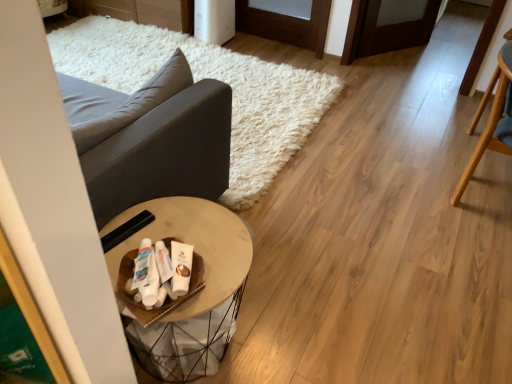
The image size is (512, 384). I want to click on white glossy tube at center, which appears as the 2th toiletry when viewed from the right, so click(x=150, y=284).

Locate an element on the screen. Image resolution: width=512 pixels, height=384 pixels. white matte toothpaste tube at center, which is counted as the 1th toiletry, starting from the left is located at coordinates (142, 264).

The image size is (512, 384). Describe the element at coordinates (190, 285) in the screenshot. I see `wooden round table at center` at that location.

This screenshot has width=512, height=384. Describe the element at coordinates (485, 99) in the screenshot. I see `light brown wooden chair at right, which ranks as the second chair in front-to-back order` at that location.

How much space does light brown wooden chair at right, which ranks as the second chair in front-to-back order, occupy vertically?

light brown wooden chair at right, which ranks as the second chair in front-to-back order, is 73.72 centimeters tall.

This screenshot has height=384, width=512. I want to click on matte black side table at center, so click(207, 77).

The image size is (512, 384). Find the location of `white matte lotion at center, which is the third toiletry in left-to-right order`. white matte lotion at center, which is the third toiletry in left-to-right order is located at coordinates (181, 267).

This screenshot has width=512, height=384. What are the coordinates of `white glossy tube at center, the 2th toiletry from the left` in the screenshot? It's located at (150, 284).

How many degrees apart are the facing directions of white matte lotion at center, arranged as the first toiletry when viewed from the right, and dark gray fabric couch at left?

They differ by 54.2 degrees in their facing directions.

Is white matte lotion at center, which is the third toiletry in left-to-right order, completely or partially outside of dark gray fabric couch at left?

Indeed, white matte lotion at center, which is the third toiletry in left-to-right order, is completely outside dark gray fabric couch at left.

From the image's perspective, would you say white matte lotion at center, arranged as the first toiletry when viewed from the right, is shown under dark gray fabric couch at left?

Correct, white matte lotion at center, arranged as the first toiletry when viewed from the right, appears lower than dark gray fabric couch at left in the image.

Who is bigger, white matte lotion at center, arranged as the first toiletry when viewed from the right, or dark gray fabric couch at left?

With larger size is dark gray fabric couch at left.

Is matte black side table at center not near white matte toothpaste tube at center, the third toiletry from the right?

Yes, matte black side table at center and white matte toothpaste tube at center, the third toiletry from the right, are located far from each other.

Does matte black side table at center have a greater width compared to white matte toothpaste tube at center, the third toiletry from the right?

Correct, the width of matte black side table at center exceeds that of white matte toothpaste tube at center, the third toiletry from the right.

Who is bigger, matte black side table at center or white matte toothpaste tube at center, the third toiletry from the right?

With larger size is matte black side table at center.

Considering the positions of points (97, 61) and (148, 242), is point (97, 61) closer to camera compared to point (148, 242)?

No, (97, 61) is further to viewer.

Find the location of a particular element. The width and height of the screenshot is (512, 384). toiletry that is the 2nd one when counting backward from the white glossy tube at center, which appears as the 2th toiletry when viewed from the right is located at coordinates (142, 264).

Considering the relative positions of white glossy tube at center, the 2th toiletry from the left, and white matte toothpaste tube at center, the third toiletry from the right, in the image provided, is white glossy tube at center, the 2th toiletry from the left, to the right of white matte toothpaste tube at center, the third toiletry from the right, from the viewer's perspective?

Indeed, white glossy tube at center, the 2th toiletry from the left, is positioned on the right side of white matte toothpaste tube at center, the third toiletry from the right.

Could you tell me if white glossy tube at center, the 2th toiletry from the left, is facing white matte toothpaste tube at center, the third toiletry from the right?

Yes, white glossy tube at center, the 2th toiletry from the left, is facing white matte toothpaste tube at center, the third toiletry from the right.

From a real-world perspective, is light wood chair at right, the 2th chair when ordered from back to front, positioned above or below light brown wooden chair at right, which ranks as the 1th chair in back-to-front order?

light wood chair at right, the 2th chair when ordered from back to front, is above light brown wooden chair at right, which ranks as the 1th chair in back-to-front order.

Considering the relative positions of light wood chair at right, acting as the first chair starting from the front, and light brown wooden chair at right, which ranks as the 1th chair in back-to-front order, in the image provided, is light wood chair at right, acting as the first chair starting from the front, to the left or to the right of light brown wooden chair at right, which ranks as the 1th chair in back-to-front order,?

In the image, light wood chair at right, acting as the first chair starting from the front, appears on the left side of light brown wooden chair at right, which ranks as the 1th chair in back-to-front order.

Can you tell me how much light wood chair at right, acting as the first chair starting from the front, and light brown wooden chair at right, which ranks as the second chair in front-to-back order, differ in facing direction?

The facing directions of light wood chair at right, acting as the first chair starting from the front, and light brown wooden chair at right, which ranks as the second chair in front-to-back order, are 99 degrees apart.

Between white matte toothpaste tube at center, which is counted as the 1th toiletry, starting from the left, and light brown wooden chair at right, which ranks as the second chair in front-to-back order, which one has less height?

Standing shorter between the two is white matte toothpaste tube at center, which is counted as the 1th toiletry, starting from the left.

From a real-world perspective, is white matte toothpaste tube at center, the third toiletry from the right, on light brown wooden chair at right, which ranks as the 1th chair in back-to-front order?

Yes, from a real-world perspective, white matte toothpaste tube at center, the third toiletry from the right, is above light brown wooden chair at right, which ranks as the 1th chair in back-to-front order.

Between white matte toothpaste tube at center, the third toiletry from the right, and light brown wooden chair at right, which ranks as the second chair in front-to-back order, which one appears on the right side from the viewer's perspective?

light brown wooden chair at right, which ranks as the second chair in front-to-back order.

Can you confirm if white matte lotion at center, which is the third toiletry in left-to-right order, is wider than light wood chair at right, the 2th chair when ordered from back to front?

Incorrect, the width of white matte lotion at center, which is the third toiletry in left-to-right order, does not surpass that of light wood chair at right, the 2th chair when ordered from back to front.

Can you confirm if white matte lotion at center, which is the third toiletry in left-to-right order, is positioned to the left of light wood chair at right, the 2th chair when ordered from back to front?

Yes.

Between white matte lotion at center, which is the third toiletry in left-to-right order, and light wood chair at right, acting as the first chair starting from the front, which one has smaller size?

white matte lotion at center, which is the third toiletry in left-to-right order, is smaller.

At what (x,y) coordinates should I click in order to perform the action: click on the 1st chair above when counting from the white matte lotion at center, arranged as the first toiletry when viewed from the right (from the image's perspective). Please return your answer as a coordinate pair (x, y). Looking at the image, I should click on (489, 119).

Is wooden round table at center facing towards light brown wooden chair at right, which ranks as the 1th chair in back-to-front order?

Yes, wooden round table at center is aimed at light brown wooden chair at right, which ranks as the 1th chair in back-to-front order.

Are wooden round table at center and light brown wooden chair at right, which ranks as the second chair in front-to-back order, far apart?

Yes, wooden round table at center and light brown wooden chair at right, which ranks as the second chair in front-to-back order, are quite far apart.

Is wooden round table at center not inside light brown wooden chair at right, which ranks as the second chair in front-to-back order?

Yes, wooden round table at center is located beyond the bounds of light brown wooden chair at right, which ranks as the second chair in front-to-back order.

Where is `studio couch positioned vertically above the white matte lotion at center, arranged as the first toiletry when viewed from the right (from a real-world perspective)`? This screenshot has width=512, height=384. studio couch positioned vertically above the white matte lotion at center, arranged as the first toiletry when viewed from the right (from a real-world perspective) is located at coordinates (159, 143).

Which toiletry is the 1st one when counting from the front of the matte black side table at center? Please provide its 2D coordinates.

[(142, 264)]

Considering their positions, is white matte toothpaste tube at center, the third toiletry from the right, positioned closer to light brown wooden chair at right, which ranks as the second chair in front-to-back order, than dark gray fabric couch at left?

Based on the image, dark gray fabric couch at left appears to be nearer to light brown wooden chair at right, which ranks as the second chair in front-to-back order.

Based on their spatial positions, is white matte lotion at center, which is the third toiletry in left-to-right order, or light wood chair at right, the 2th chair when ordered from back to front, further from white matte toothpaste tube at center, which is counted as the 1th toiletry, starting from the left?

The object further to white matte toothpaste tube at center, which is counted as the 1th toiletry, starting from the left, is light wood chair at right, the 2th chair when ordered from back to front.

Looking at the image, which one is located closer to light wood chair at right, acting as the first chair starting from the front, white matte lotion at center, arranged as the first toiletry when viewed from the right, or dark gray fabric couch at left?

dark gray fabric couch at left lies closer to light wood chair at right, acting as the first chair starting from the front, than the other object.

Which object lies nearer to the anchor point white matte lotion at center, arranged as the first toiletry when viewed from the right, matte black side table at center or dark gray fabric couch at left?

dark gray fabric couch at left is positioned closer to the anchor white matte lotion at center, arranged as the first toiletry when viewed from the right.

Considering their positions, is dark gray fabric couch at left positioned closer to matte black side table at center than white matte lotion at center, which is the third toiletry in left-to-right order?

Based on the image, dark gray fabric couch at left appears to be nearer to matte black side table at center.

When comparing their distances from white glossy tube at center, which appears as the 2th toiletry when viewed from the right, does dark gray fabric couch at left or white matte toothpaste tube at center, the third toiletry from the right, seem closer?

The object closer to white glossy tube at center, which appears as the 2th toiletry when viewed from the right, is white matte toothpaste tube at center, the third toiletry from the right.

From the image, which object appears to be farther from matte black side table at center, dark gray fabric couch at left or white matte toothpaste tube at center, which is counted as the 1th toiletry, starting from the left?

white matte toothpaste tube at center, which is counted as the 1th toiletry, starting from the left, lies further to matte black side table at center than the other object.

Looking at the image, which one is located closer to matte black side table at center, white glossy tube at center, the 2th toiletry from the left, or light brown wooden chair at right, which ranks as the second chair in front-to-back order?

light brown wooden chair at right, which ranks as the second chair in front-to-back order, is closer to matte black side table at center.

At what (x,y) coordinates should I click in order to perform the action: click on toiletry located between white matte toothpaste tube at center, the third toiletry from the right, and white matte lotion at center, arranged as the first toiletry when viewed from the right, in the left-right direction. Please return your answer as a coordinate pair (x, y). The image size is (512, 384). Looking at the image, I should click on (150, 284).

This screenshot has width=512, height=384. In order to click on toiletry located between wooden round table at center and light wood chair at right, the 2th chair when ordered from back to front, in the left-right direction in this screenshot , I will do `click(181, 267)`.

Find the location of a particular element. The image size is (512, 384). table between dark gray fabric couch at left and light brown wooden chair at right, which ranks as the 1th chair in back-to-front order, in the horizontal direction is located at coordinates (190, 285).

Identify the location of studio couch between matte black side table at center and white matte toothpaste tube at center, the third toiletry from the right, vertically. Image resolution: width=512 pixels, height=384 pixels. (159, 143).